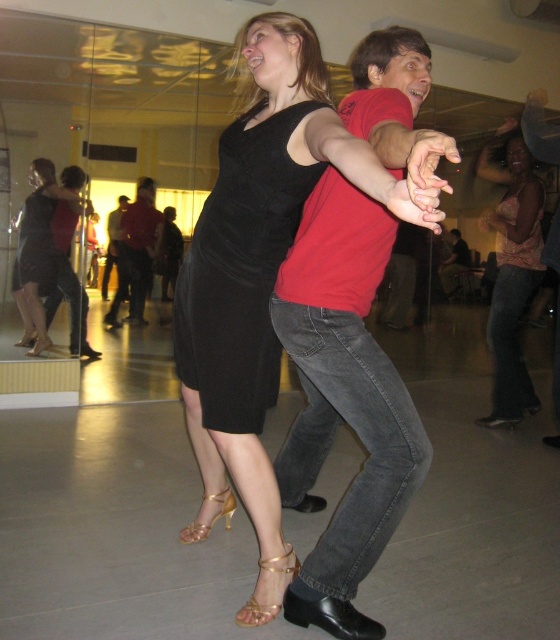
Does red cotton shirt at center have a lesser height compared to black satin dress at center?

No, red cotton shirt at center is not shorter than black satin dress at center.

Is point (141, 300) closer to camera compared to point (32, 282)?

No, it is behind (32, 282).

Between point (136, 196) and point (18, 285), which one is positioned in front?

Point (18, 285)

Where is `red cotton shirt at center`? The image size is (560, 640). red cotton shirt at center is located at coordinates (137, 253).

The image size is (560, 640). What do you see at coordinates (240, 273) in the screenshot? I see `black velvet dress at center` at bounding box center [240, 273].

Which is in front, point (220, 280) or point (132, 237)?

Point (220, 280) is more forward.

Locate an element on the screen. The width and height of the screenshot is (560, 640). black velvet dress at center is located at coordinates (240, 273).

Which is in front, point (280, 320) or point (305, 196)?

Point (305, 196)

Is point (312, 252) positioned behind point (263, 422)?

No, it is not.

Between point (380, 538) and point (234, 253), which one is positioned in front?

Positioned in front is point (380, 538).

This screenshot has width=560, height=640. Find the location of `matte red t-shirt at center`. matte red t-shirt at center is located at coordinates (343, 401).